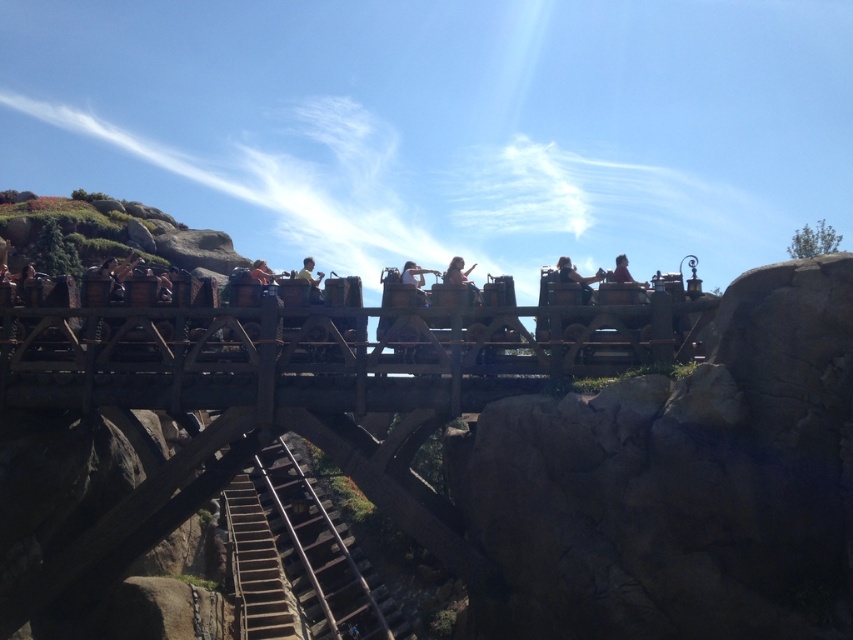
Question: Which of the following is the closest to the observer?

Choices:
 (A) (785, 268)
 (B) (260, 637)

Answer: (A)

Question: Which object appears farthest from the camera in this image?

Choices:
 (A) matte brown hair at center
 (B) matte yellow shirt at center

Answer: (A)

Question: Can you confirm if wooden at center is smaller than light brown wooden roller coaster car at center?

Choices:
 (A) no
 (B) yes

Answer: (A)

Question: In this image, where is light brown wooden bench at center located relative to matte yellow shirt at center?

Choices:
 (A) above
 (B) below

Answer: (A)

Question: Is matte brown hair at center closer to camera compared to matte yellow shirt at center?

Choices:
 (A) no
 (B) yes

Answer: (A)

Question: Which point is farther to the camera?

Choices:
 (A) matte brown hair at center
 (B) wooden at center

Answer: (A)